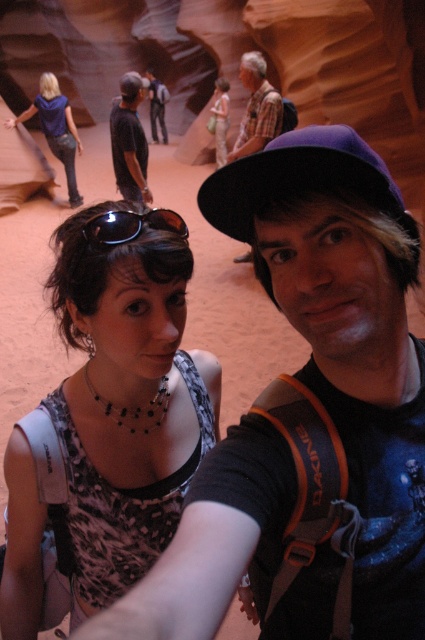
You are planning to take a photo in this canyon scene. You want to ensure that both the dark gray shirt at center and the matte blue shirt at upper left are in focus. The camera you are using has a depth of field that can cover 8 feet. Will both subjects be in focus?

The distance between the dark gray shirt at center and matte blue shirt at upper left is 9.12 feet. Since the camera can only cover 8 feet, the subjects will not both be in focus.

Looking at this image, you are a photographer planning to take a photo of the leopard print tank top at center in the canyon. Your camera is 33.81 inches away from the tank top. Is this distance sufficient to capture the entire tank top in the frame?

The leopard print tank top at center and camera are 33.81 inches apart. This distance may be sufficient depending on the camera lens used. A standard lens might require closer proximity, while a wide angle lens could capture the entire tank top from this distance.

You are a photographer planning to take a photo of the two people in the canyon. You notice the matte black hat at center and the sunglasses at center. Which object should you adjust to ensure both are fully visible in the frame?

The matte black hat at center is positioned on the right side of sunglasses at center. To ensure both are fully visible, adjust the sunglasses at center to move them to the left, creating space for the matte black hat at center to be in frame.